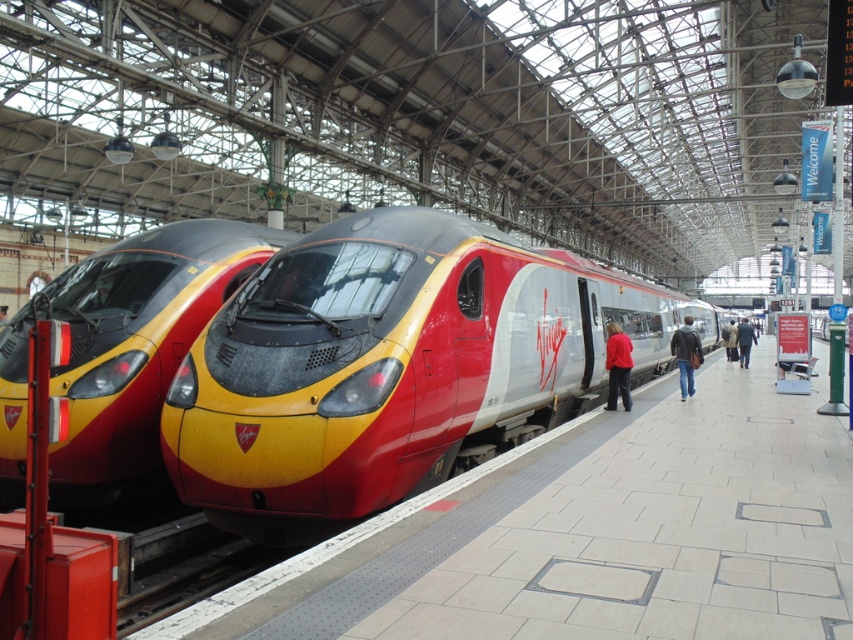
Does point (498, 387) lie behind point (741, 323)?

No, (498, 387) is closer to viewer.

Can you confirm if metallic red train at center is shorter than dark blue coat at platform center?

Incorrect, metallic red train at center's height does not fall short of dark blue coat at platform center's.

I want to click on metallic red train at center, so click(x=392, y=365).

Is point (131, 440) positioned behind point (686, 321)?

No, it is not.

Is metallic red/yellow train at center thinner than leather jacket at platform?

Yes.

Is point (157, 244) behind point (677, 340)?

No, it is not.

Find the location of a particular element. metallic red/yellow train at center is located at coordinates (125, 342).

Is point (614, 353) positioned in front of point (675, 349)?

Yes, it is.

Which is more to the right, red fabric jacket at center or leather jacket at platform?

leather jacket at platform is more to the right.

Between point (611, 364) and point (675, 353), which one is positioned behind?

Positioned behind is point (675, 353).

Locate an element on the screen. The image size is (853, 640). red fabric jacket at center is located at coordinates (618, 365).